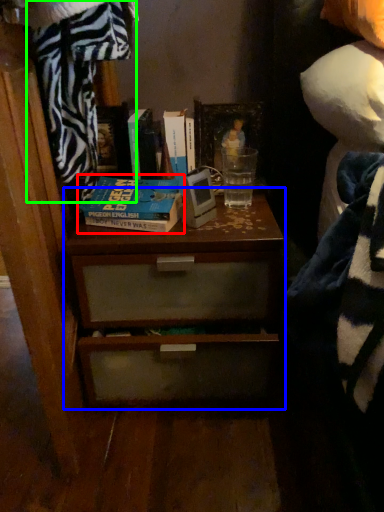
Question: Based on their relative distances, which object is nearer to book (highlighted by a red box)? Choose from chest of drawers (highlighted by a blue box) and blanket (highlighted by a green box).

Choices:
 (A) chest of drawers
 (B) blanket

Answer: (B)